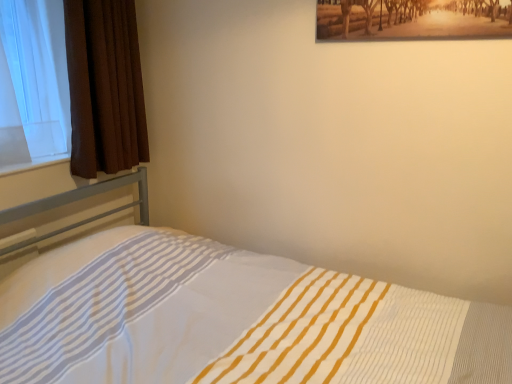
Question: From a real-world perspective, is brown textured curtain at left below white striped bed at lower left?

Choices:
 (A) yes
 (B) no

Answer: (B)

Question: Can you confirm if brown textured curtain at left is bigger than white striped bed at lower left?

Choices:
 (A) no
 (B) yes

Answer: (A)

Question: Is brown textured curtain at left shorter than white striped bed at lower left?

Choices:
 (A) no
 (B) yes

Answer: (B)

Question: Is brown textured curtain at left facing towards white striped bed at lower left?

Choices:
 (A) no
 (B) yes

Answer: (A)

Question: Is brown textured curtain at left facing away from white striped bed at lower left?

Choices:
 (A) no
 (B) yes

Answer: (A)

Question: Is brown textured curtain at left at the left side of white striped bed at lower left?

Choices:
 (A) no
 (B) yes

Answer: (B)

Question: From the image's perspective, is white striped bed at lower left under brown textured curtain at left?

Choices:
 (A) yes
 (B) no

Answer: (A)

Question: Does white striped bed at lower left have a greater width compared to brown textured curtain at left?

Choices:
 (A) yes
 (B) no

Answer: (A)

Question: Considering the relative sizes of white striped bed at lower left and brown textured curtain at left in the image provided, is white striped bed at lower left taller than brown textured curtain at left?

Choices:
 (A) no
 (B) yes

Answer: (B)

Question: Is white striped bed at lower left further to the viewer compared to brown textured curtain at left?

Choices:
 (A) yes
 (B) no

Answer: (B)

Question: Does white striped bed at lower left have a lesser height compared to brown textured curtain at left?

Choices:
 (A) no
 (B) yes

Answer: (A)

Question: Is white striped bed at lower left with brown textured curtain at left?

Choices:
 (A) no
 (B) yes

Answer: (A)

Question: From the image's perspective, is brown textured curtain at left positioned above or below white striped bed at lower left?

Choices:
 (A) below
 (B) above

Answer: (B)